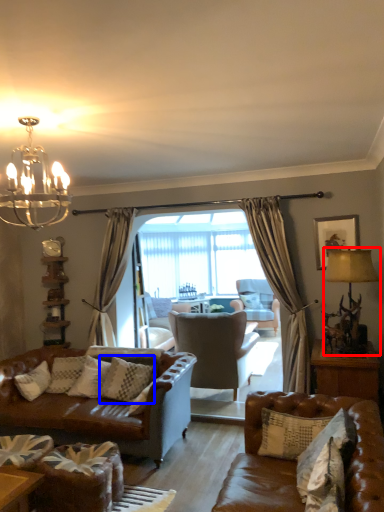
Question: Which object is further to the camera taking this photo, lamp (highlighted by a red box) or pillow (highlighted by a blue box)?

Choices:
 (A) lamp
 (B) pillow

Answer: (B)